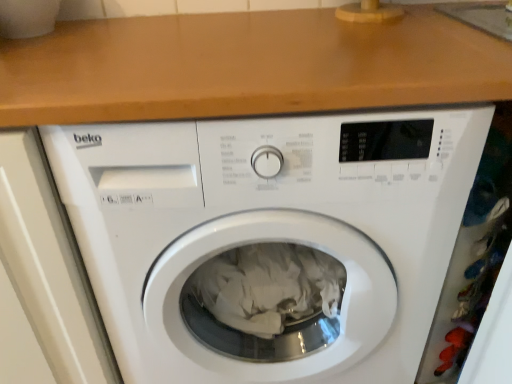
Question: Is the position of wooden at upper center less distant than that of white plastic washing machine at center?

Choices:
 (A) yes
 (B) no

Answer: (A)

Question: From the image's perspective, is wooden at upper center below white plastic washing machine at center?

Choices:
 (A) yes
 (B) no

Answer: (B)

Question: Is wooden at upper center oriented towards white plastic washing machine at center?

Choices:
 (A) no
 (B) yes

Answer: (A)

Question: Is wooden at upper center behind white plastic washing machine at center?

Choices:
 (A) no
 (B) yes

Answer: (A)

Question: From a real-world perspective, is wooden at upper center beneath white plastic washing machine at center?

Choices:
 (A) yes
 (B) no

Answer: (B)

Question: Can you confirm if wooden at upper center is bigger than white plastic washing machine at center?

Choices:
 (A) no
 (B) yes

Answer: (A)

Question: Is the position of white plastic washing machine at center more distant than that of wooden at upper center?

Choices:
 (A) no
 (B) yes

Answer: (B)

Question: Is white plastic washing machine at center taller than wooden at upper center?

Choices:
 (A) no
 (B) yes

Answer: (B)

Question: Is white plastic washing machine at center at the left side of wooden at upper center?

Choices:
 (A) no
 (B) yes

Answer: (A)

Question: Does white plastic washing machine at center have a smaller size compared to wooden at upper center?

Choices:
 (A) no
 (B) yes

Answer: (A)

Question: From the image's perspective, is white plastic washing machine at center above wooden at upper center?

Choices:
 (A) no
 (B) yes

Answer: (A)

Question: Is white plastic washing machine at center positioned far away from wooden at upper center?

Choices:
 (A) yes
 (B) no

Answer: (B)

Question: From a real-world perspective, is wooden at upper center above or below white plastic washing machine at center?

Choices:
 (A) below
 (B) above

Answer: (B)